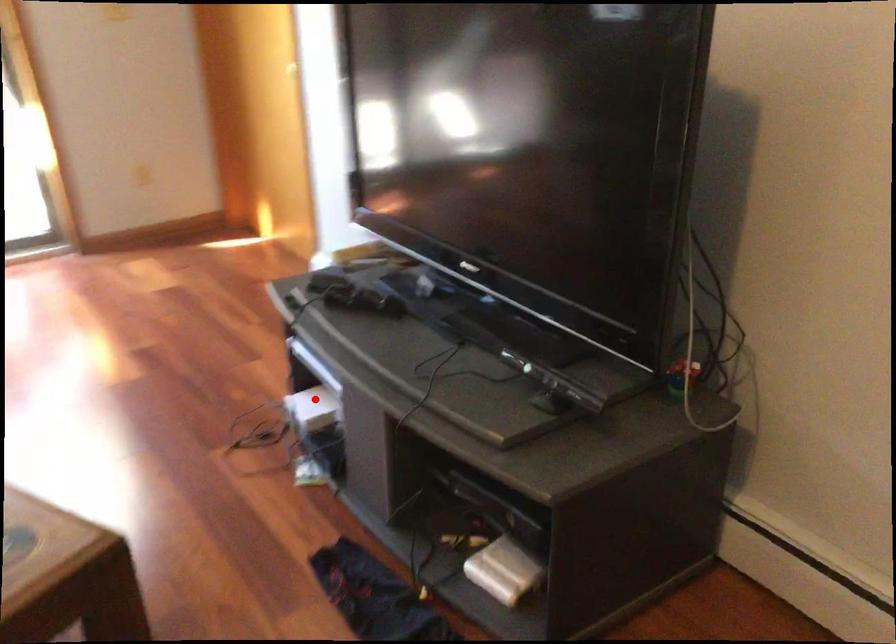
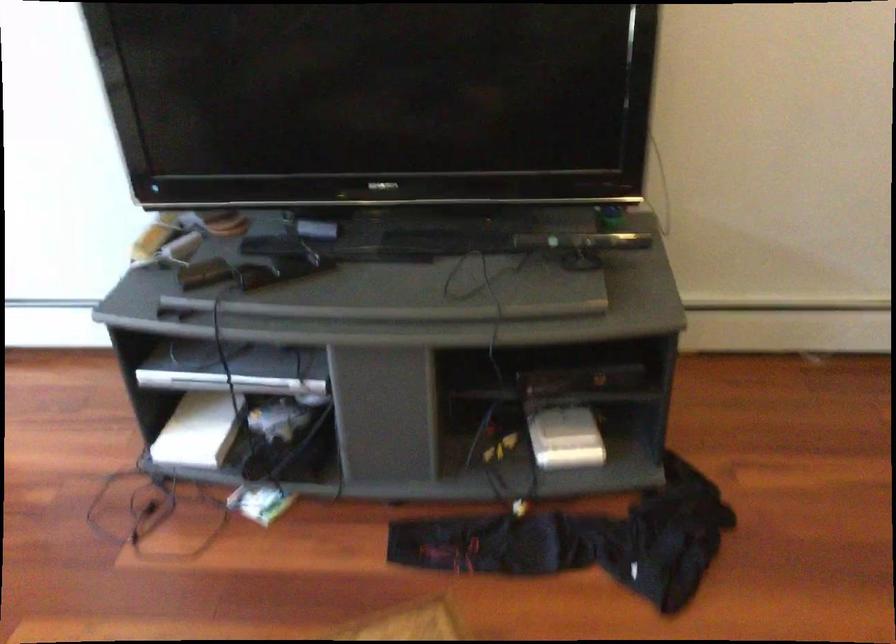
Find the pixel in the second image that matches the highlighted location in the first image.

(199, 430)